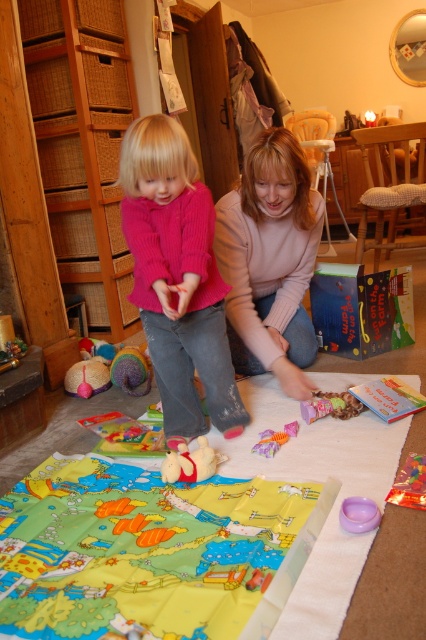
You are a parent trying to retrieve the fluffy plush toy at center from behind the matte pink sweater at center. Can you easily reach it without moving the sweater?

Result: The fluffy plush toy at center is behind the matte pink sweater at center, so you can easily reach it by moving around the sweater or from the sides since it is positioned behind.